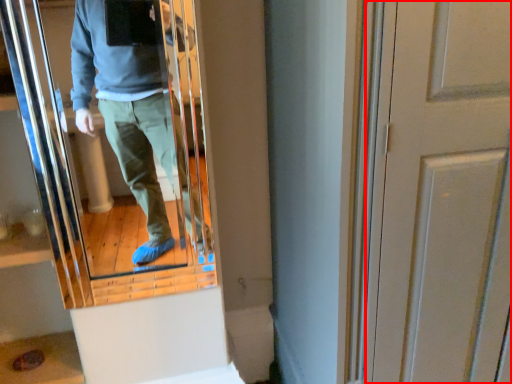
Question: From the image's perspective, what is the correct spatial relationship of door (annotated by the red box) in relation to mirror?

Choices:
 (A) above
 (B) below

Answer: (B)